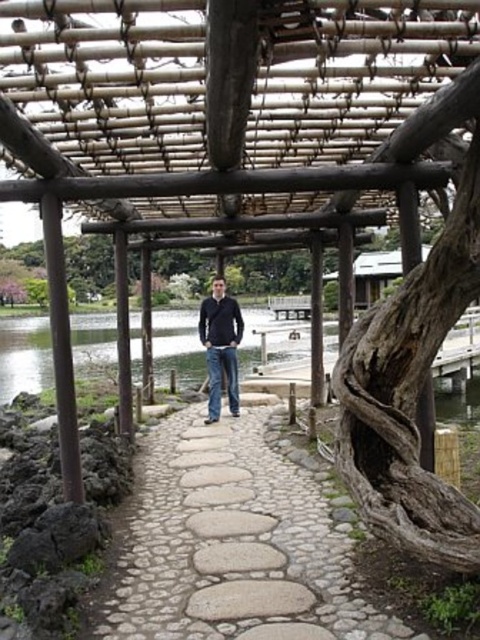
Is natural stone pathway at center shorter than clear water at center?

Yes.

From the picture: Can you confirm if natural stone pathway at center is wider than clear water at center?

Indeed, natural stone pathway at center has a greater width compared to clear water at center.

Find the location of `natural stone pathway at center`. natural stone pathway at center is located at coordinates (231, 545).

You are a GUI agent. You are given a task and a screenshot of the screen. Output one action in this format:
    pyautogui.click(x=<x>, y=<y>)
    Task: Click on the natural stone pathway at center
    
    Given the screenshot: What is the action you would take?
    pyautogui.click(x=231, y=545)

Does clear water at center lie in front of dark blue jeans at center?

No, clear water at center is behind dark blue jeans at center.

Between clear water at center and dark blue jeans at center, which one appears on the left side from the viewer's perspective?

From the viewer's perspective, clear water at center appears more on the left side.

Identify the location of clear water at center. (24, 356).

Describe the element at coordinates (231, 545) in the screenshot. I see `natural stone pathway at center` at that location.

Who is positioned more to the right, natural stone pathway at center or dark blue jeans at center?

Positioned to the right is natural stone pathway at center.

Between point (217, 566) and point (230, 339), which one is positioned behind?

The point (230, 339) is more distant.

The width and height of the screenshot is (480, 640). I want to click on natural stone pathway at center, so click(231, 545).